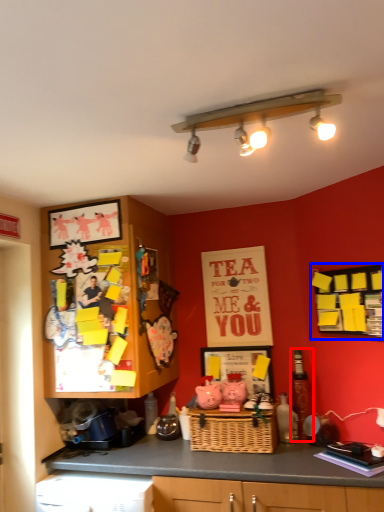
Question: Which point is further to the camera, bottle (highlighted by a red box) or bulletin board (highlighted by a blue box)?

Choices:
 (A) bottle
 (B) bulletin board

Answer: (A)